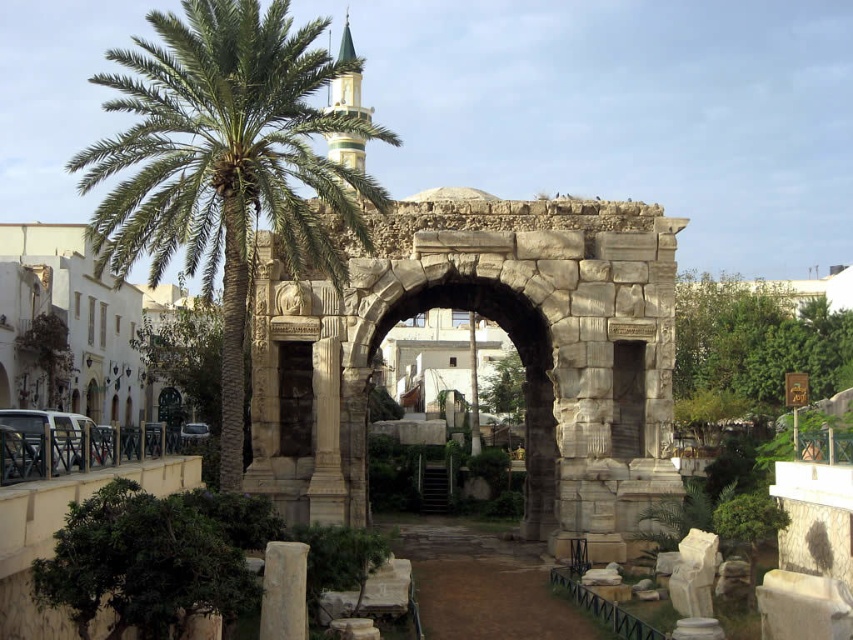
You are a tourist standing in front of the light beige stone column at lower center and the gray stone arch at center. Which object is closer to you?

The light beige stone column at lower center is closer to you because it is positioned in front of the gray stone arch at center.

You are a tourist standing in front of the dark stone arch at center and gray stone arch at center in the courtyard. Which arch is closer to you?

The dark stone arch at center is closer to you since the gray stone arch at center is behind it.